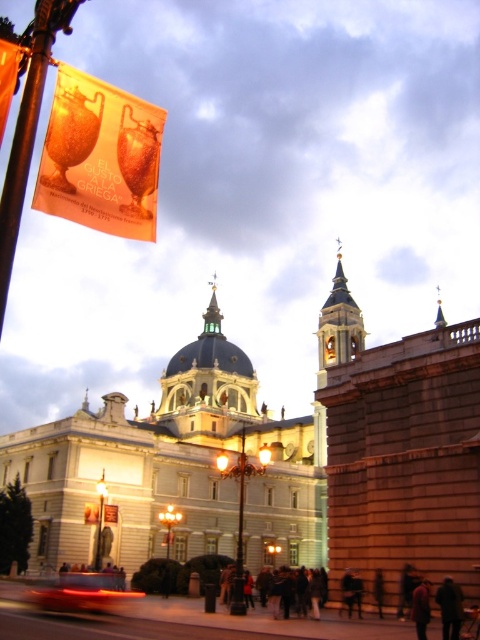
Is point (328, 321) positioned before point (423, 634)?

No, it is behind (423, 634).

Is gold textured spire at upper center behind dark brown leather jacket at lower right?

Yes, it is behind dark brown leather jacket at lower right.

Does point (346, 339) come in front of point (414, 608)?

No, it is not.

Locate an element on the screen. gold textured spire at upper center is located at coordinates (338, 324).

Can you confirm if golden dome at center is taller than blurred red car at lower left?

Yes.

Is golden dome at center positioned at the back of blurred red car at lower left?

Yes, it is.

Where is `golden dome at center`? The height and width of the screenshot is (640, 480). golden dome at center is located at coordinates (208, 381).

Who is higher up, white stone church at center or dark brown leather coat at lower right?

white stone church at center is higher up.

Is white stone church at center above dark brown leather coat at lower right?

Yes.

Does point (231, 504) come closer to viewer compared to point (458, 634)?

That is False.

Image resolution: width=480 pixels, height=640 pixels. I want to click on white stone church at center, so click(172, 470).